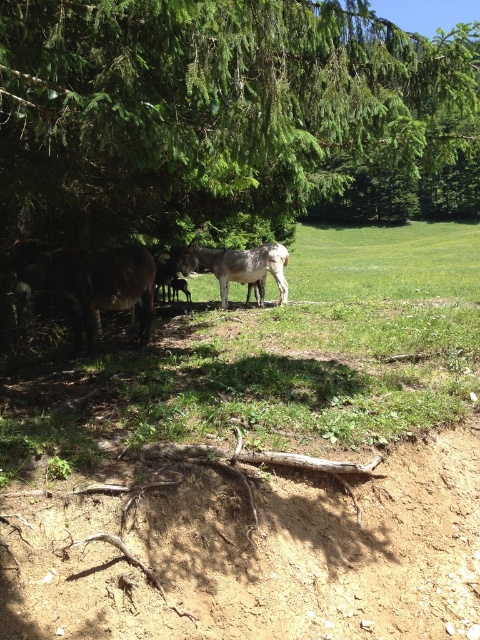
Question: Is green leafy tree at center behind green grassy at lower center?

Choices:
 (A) no
 (B) yes

Answer: (A)

Question: Considering the real-world distances, which object is farthest from the gray matte donkey at center?

Choices:
 (A) green leafy tree at center
 (B) brown fuzzy donkey at left

Answer: (B)

Question: Which point is farther to the camera?

Choices:
 (A) green leafy tree at center
 (B) green grassy at lower center
 (C) brown fuzzy donkey at left

Answer: (C)

Question: Which of the following is the farthest from the observer?

Choices:
 (A) (78, 248)
 (B) (247, 348)
 (C) (369, 26)
 (D) (263, 292)

Answer: (D)

Question: Is brown fuzzy donkey at left to the left of gray matte donkey at center from the viewer's perspective?

Choices:
 (A) yes
 (B) no

Answer: (A)

Question: Observing the image, what is the correct spatial positioning of green grassy at lower center in reference to brown fuzzy donkey at left?

Choices:
 (A) right
 (B) left

Answer: (A)